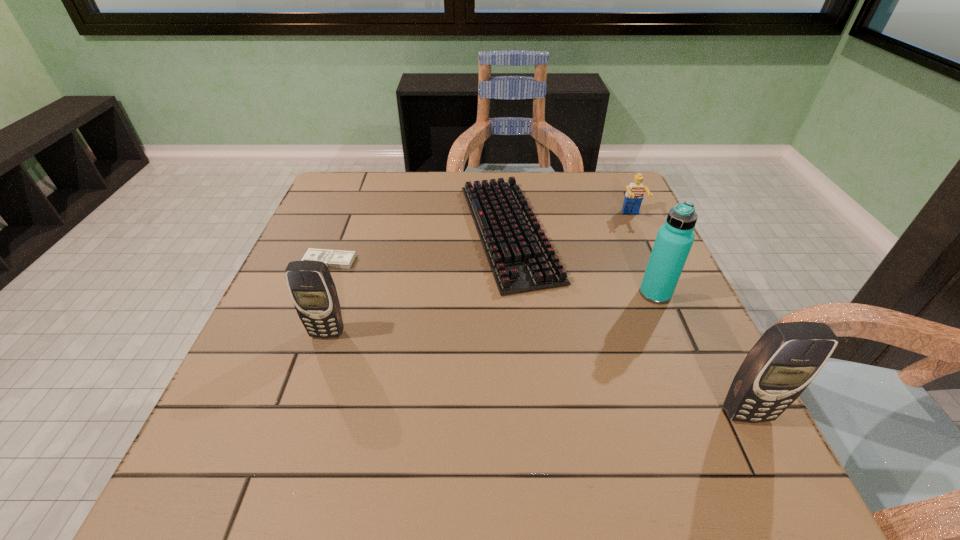
Identify the location of vacant spot for a new cellular_telephone to ensure equal spacing. (519, 370).